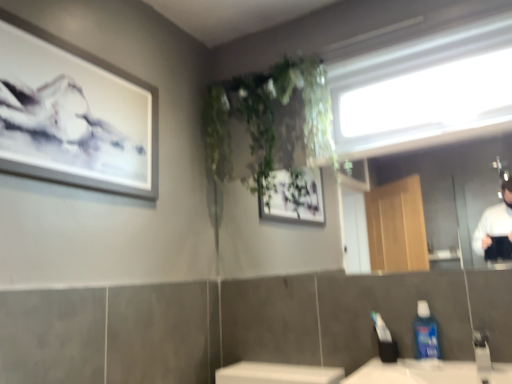
Question: From a real-world perspective, is clear glass mirror at upper center beneath white matte picture frame at upper left?

Choices:
 (A) no
 (B) yes

Answer: (B)

Question: Can you confirm if clear glass mirror at upper center is shorter than white matte picture frame at upper left?

Choices:
 (A) yes
 (B) no

Answer: (A)

Question: Is clear glass mirror at upper center further to the viewer compared to white matte picture frame at upper left?

Choices:
 (A) yes
 (B) no

Answer: (A)

Question: Does clear glass mirror at upper center have a smaller size compared to white matte picture frame at upper left?

Choices:
 (A) yes
 (B) no

Answer: (B)

Question: Does clear glass mirror at upper center have a greater height compared to white matte picture frame at upper left?

Choices:
 (A) yes
 (B) no

Answer: (B)

Question: From a real-world perspective, is clear glass mirror at upper center on top of white matte picture frame at upper left?

Choices:
 (A) no
 (B) yes

Answer: (A)

Question: Is silver metallic faucet at lower right at the back of transparent glass window at upper center?

Choices:
 (A) yes
 (B) no

Answer: (B)

Question: Is silver metallic faucet at lower right surrounded by transparent glass window at upper center?

Choices:
 (A) yes
 (B) no

Answer: (B)

Question: From a real-world perspective, is transparent glass window at upper center below silver metallic faucet at lower right?

Choices:
 (A) no
 (B) yes

Answer: (A)

Question: Can you confirm if transparent glass window at upper center is taller than silver metallic faucet at lower right?

Choices:
 (A) yes
 (B) no

Answer: (A)

Question: Is transparent glass window at upper center further to the viewer compared to silver metallic faucet at lower right?

Choices:
 (A) yes
 (B) no

Answer: (A)

Question: Is the surface of transparent glass window at upper center in direct contact with silver metallic faucet at lower right?

Choices:
 (A) no
 (B) yes

Answer: (A)

Question: Considering the relative sizes of blue glossy mouthwash at lower right and transparent glass window at upper center in the image provided, is blue glossy mouthwash at lower right shorter than transparent glass window at upper center?

Choices:
 (A) yes
 (B) no

Answer: (A)